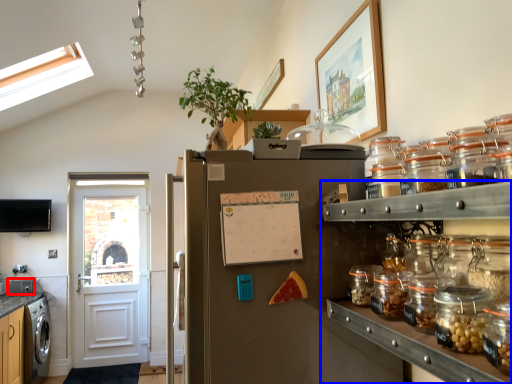
Question: Which of the following is the farthest to the observer, appliance (highlighted by a red box) or shelf (highlighted by a blue box)?

Choices:
 (A) appliance
 (B) shelf

Answer: (A)